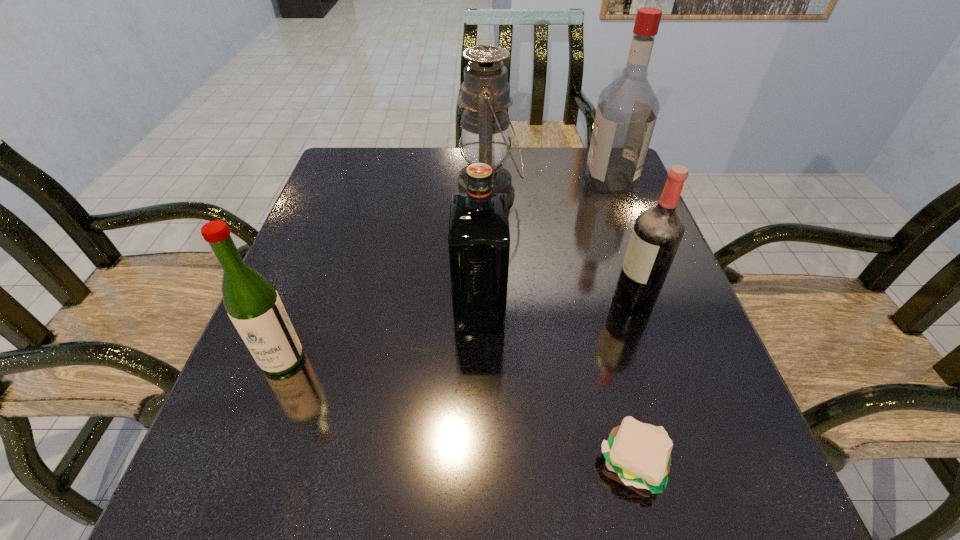
Locate an element on the screen. This screenshot has height=540, width=960. the farthest liquor is located at coordinates (627, 109).

The width and height of the screenshot is (960, 540). Identify the location of oil lamp. (485, 93).

Find the location of `the second liquor from left to right`. the second liquor from left to right is located at coordinates (479, 238).

This screenshot has width=960, height=540. Find the location of `the nearest liquor`. the nearest liquor is located at coordinates (252, 303).

What are the coordinates of `the fifth farthest object` in the screenshot? It's located at (252, 303).

The height and width of the screenshot is (540, 960). Find the location of `the shortest object`. the shortest object is located at coordinates (639, 453).

You are a GUI agent. You are given a task and a screenshot of the screen. Output one action in this format:
    pyautogui.click(x=<x>, y=<y>)
    Task: Click on the nearest object
    This screenshot has height=540, width=960.
    Given the screenshot: What is the action you would take?
    pyautogui.click(x=639, y=453)

You are a GUI agent. You are given a task and a screenshot of the screen. Output one action in this format:
    pyautogui.click(x=<x>, y=<y>)
    Task: Click on the vacant region located 0.170m on the front-facing side of the farthest liquor
    
    Given the screenshot: What is the action you would take?
    pyautogui.click(x=524, y=182)

In order to click on blank space located on the front-facing side of the farthest liquor in this screenshot , I will do `click(550, 182)`.

Find the location of a particular element. vacant space situated 0.200m on the front-facing side of the farthest liquor is located at coordinates (514, 182).